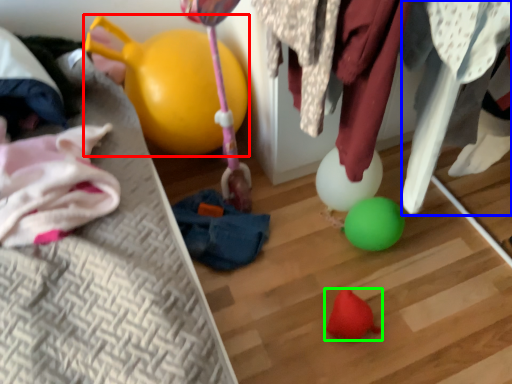
Question: Which object is positioned farthest from balloon (highlighted by a red box)? Select from clothing (highlighted by a blue box) and toy (highlighted by a green box).

Choices:
 (A) clothing
 (B) toy

Answer: (B)